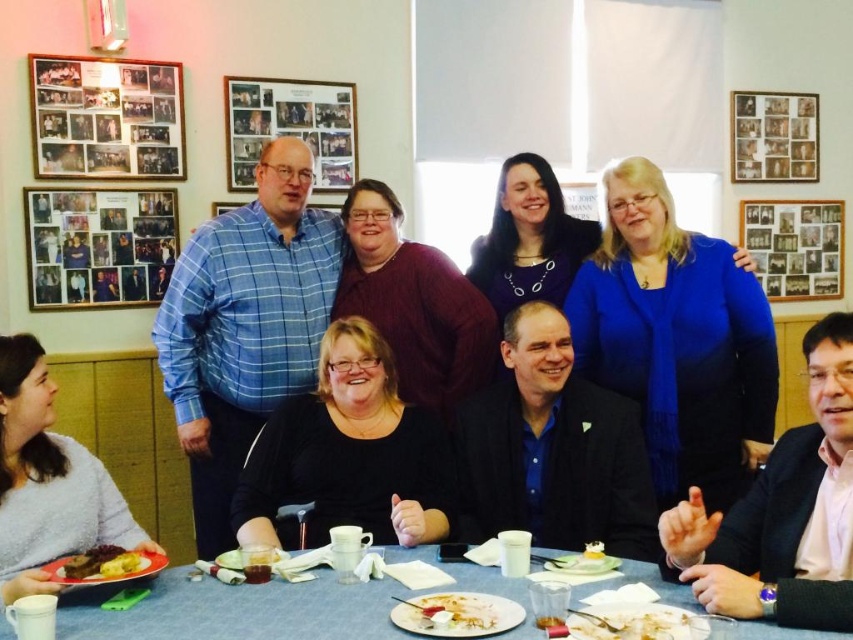
You are a waiter at this restaurant and need to deliver a dessert to the customer wearing the blue plaid shirt at upper left. The dessert is currently placed on the table at the location of the white creamy food at lower center. Can you reach the customer without moving the table? The minimum distance required for you to walk around the table is 5 feet.

The distance between the blue plaid shirt at upper left and the white creamy food at lower center is 4.69 feet. Since the required minimum distance to walk around the table is 5 feet, the waiter cannot reach the customer without moving the table.

You are a photographer at the event and want to capture a photo of the blue plaid shirt at upper left and the white creamy food at lower center. Which object is positioned higher in the image?

The blue plaid shirt at upper left is located above the white creamy food at lower center, so it is positioned higher in the image.